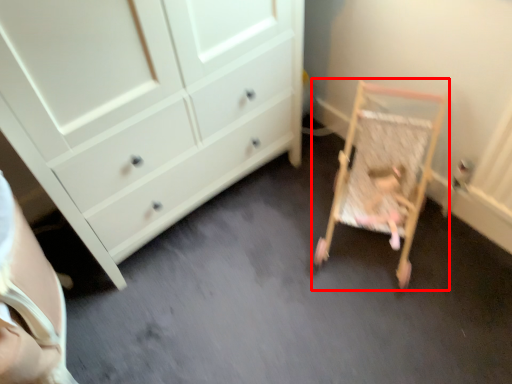
Question: From the image's perspective, considering the relative positions of furniture (annotated by the red box) and person in the image provided, where is furniture (annotated by the red box) located with respect to the staircase?

Choices:
 (A) above
 (B) below

Answer: (A)